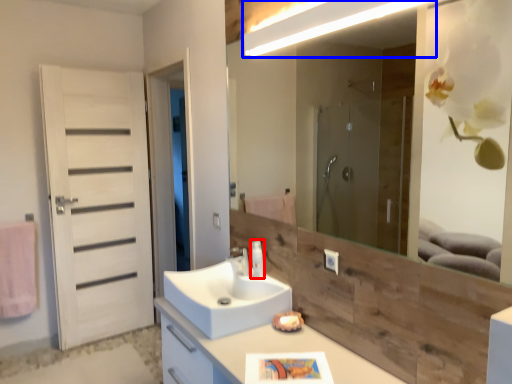
Question: Which object is closer to the camera taking this photo, soap dispenser (highlighted by a red box) or light fixture (highlighted by a blue box)?

Choices:
 (A) soap dispenser
 (B) light fixture

Answer: (B)